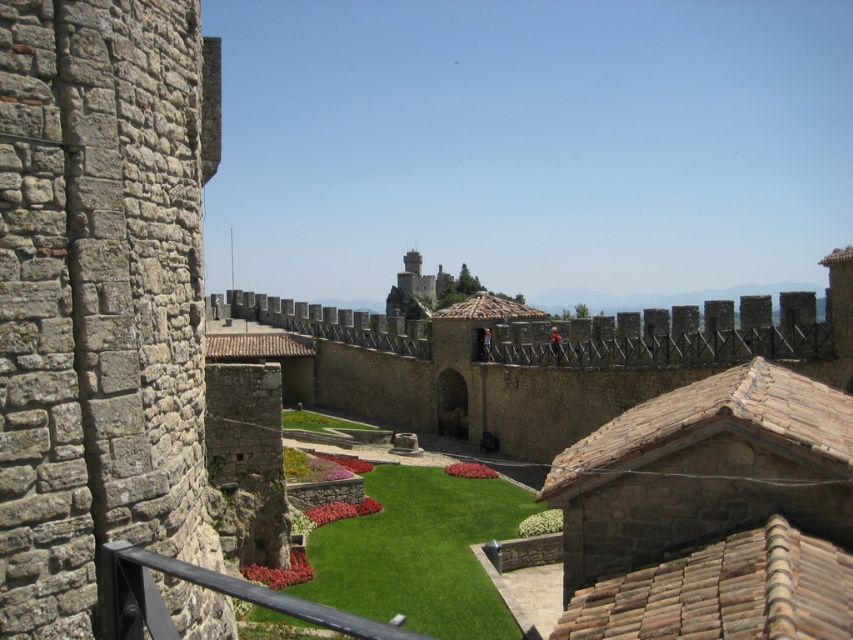
Between green artificial turf at center and green grass at center, which one appears on the left side from the viewer's perspective?

green grass at center is more to the left.

Does green artificial turf at center appear over green grass at center?

Incorrect, green artificial turf at center is not positioned above green grass at center.

Find the location of a particular element. green artificial turf at center is located at coordinates (419, 552).